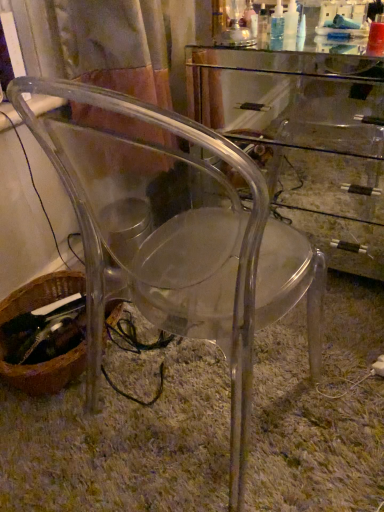
Question: Is transparent acrylic chair at center to the left or to the right of transparent acrylic computer desk at center in the image?

Choices:
 (A) right
 (B) left

Answer: (B)

Question: Considering the positions of transparent acrylic chair at center and transparent acrylic computer desk at center in the image, is transparent acrylic chair at center bigger or smaller than transparent acrylic computer desk at center?

Choices:
 (A) small
 (B) big

Answer: (A)

Question: Which object is positioned farthest from the transparent acrylic computer desk at center?

Choices:
 (A) brown woven basket at lower left
 (B) transparent acrylic chair at center

Answer: (A)

Question: Which object is positioned closest to the transparent acrylic computer desk at center?

Choices:
 (A) brown woven basket at lower left
 (B) transparent acrylic chair at center

Answer: (B)